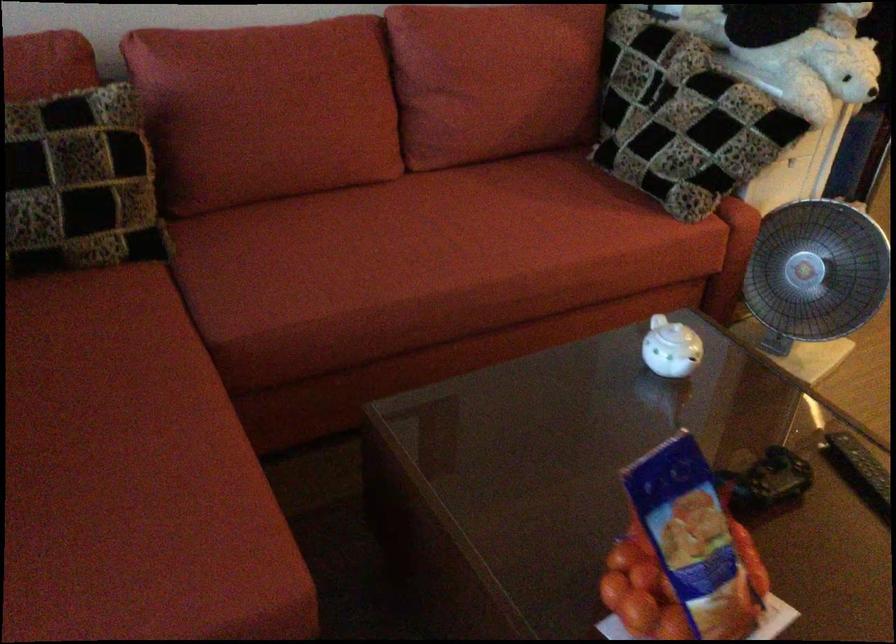
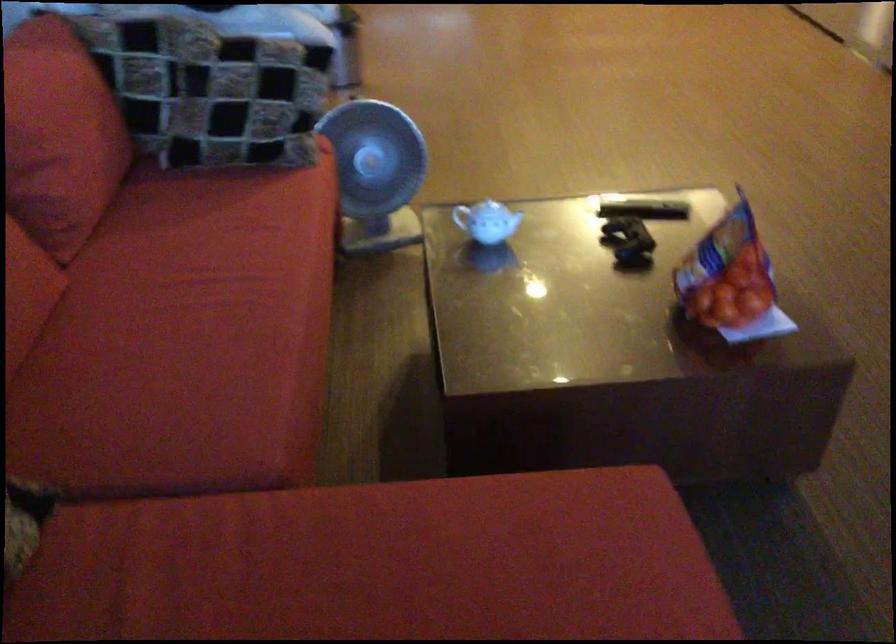
Find the pixel in the second image that matches pixel 649 343 in the first image.

(487, 220)